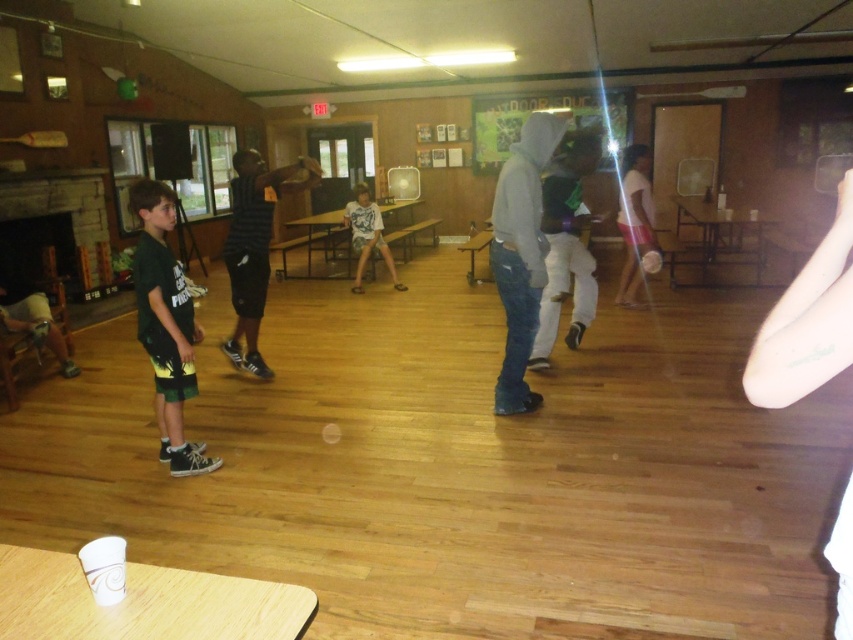
Question: Where is black mesh shirt at center located in relation to white cotton shirt at center in the image?

Choices:
 (A) above
 (B) below

Answer: (B)

Question: Which point is closer to the camera?

Choices:
 (A) (140, 304)
 (B) (641, 240)
 (C) (316, 180)
 (D) (521, 285)

Answer: (A)

Question: Can you confirm if black mesh shirt at center is wider than white matte shirt at center?

Choices:
 (A) yes
 (B) no

Answer: (A)

Question: Which point is farther from the camera taking this photo?

Choices:
 (A) (194, 326)
 (B) (379, 211)
 (C) (514, 236)
 (D) (642, 164)

Answer: (B)

Question: Which object is farther from the camera taking this photo?

Choices:
 (A) green fabric shorts at left
 (B) black mesh shirt at center
 (C) white matte shirt at center

Answer: (C)

Question: In this image, where is green fabric shorts at left located relative to white matte shirt at center?

Choices:
 (A) below
 (B) above

Answer: (A)